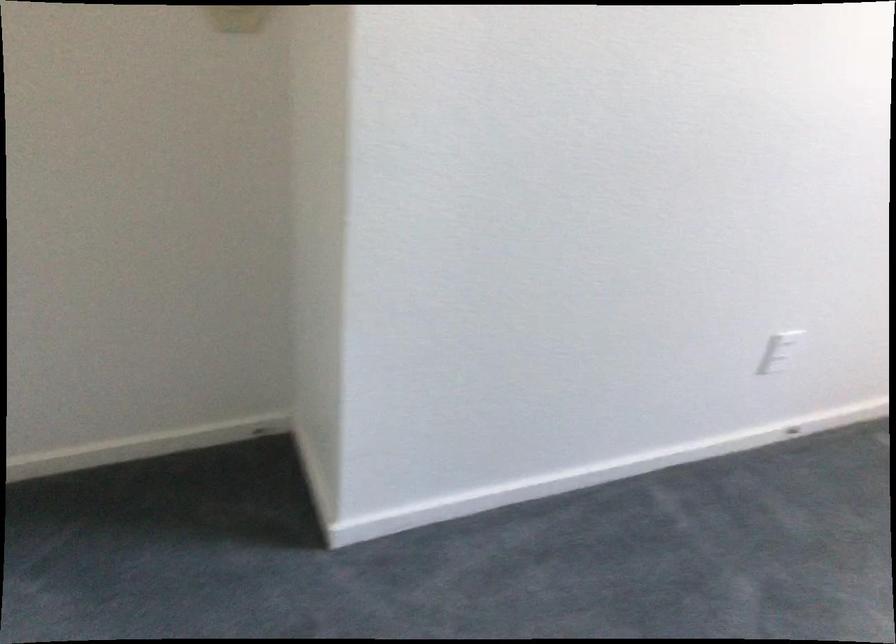
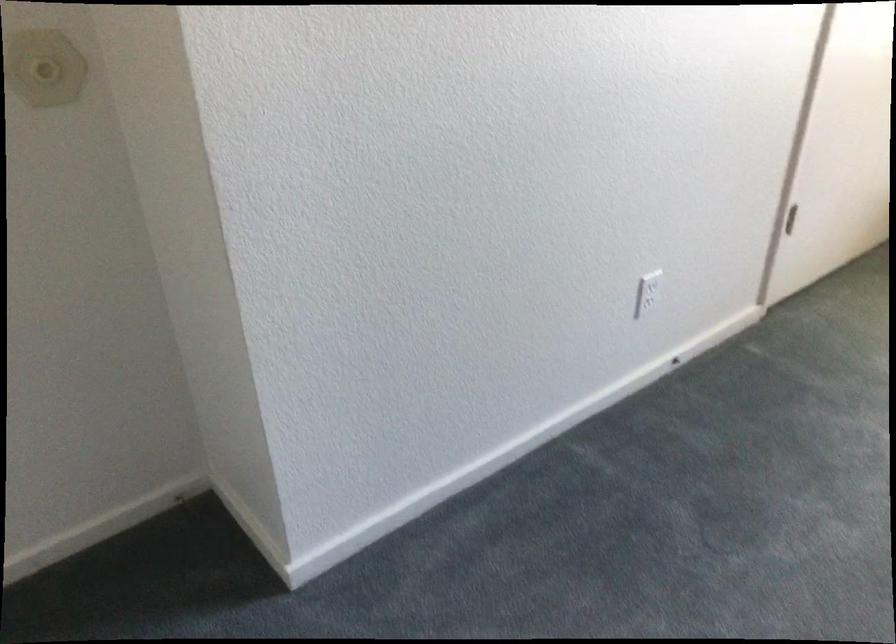
Question: The camera is either moving clockwise (left) or counter-clockwise (right) around the object. The first image is from the beginning of the video and the second image is from the end. Is the camera moving left or right when shooting the video?

Choices:
 (A) Left
 (B) Right

Answer: (A)